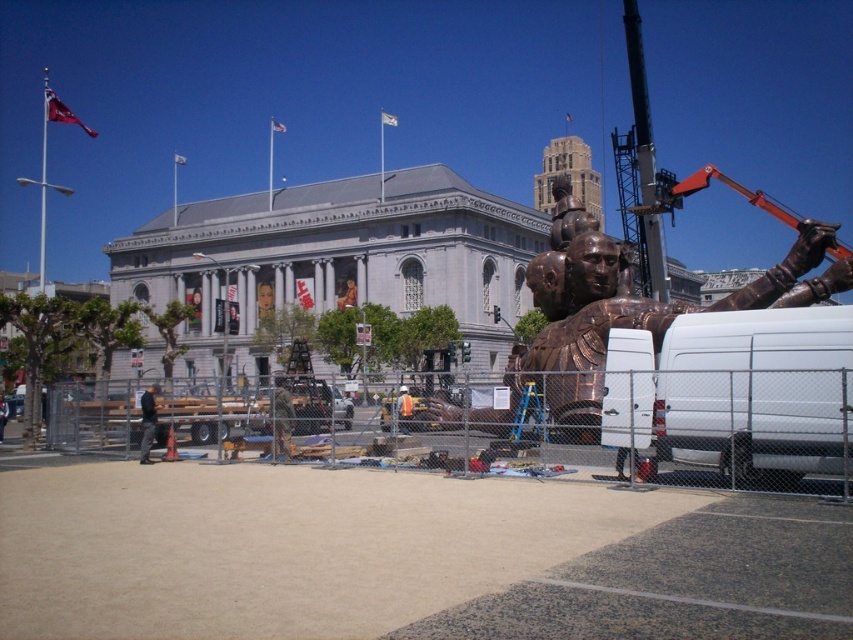
Can you confirm if copper metallic statue at right is shorter than black fabric jacket at center?

Incorrect, copper metallic statue at right's height does not fall short of black fabric jacket at center's.

Does copper metallic statue at right appear on the left side of black fabric jacket at center?

In fact, copper metallic statue at right is to the right of black fabric jacket at center.

This screenshot has width=853, height=640. In order to click on copper metallic statue at right in this screenshot , I will do `click(630, 305)`.